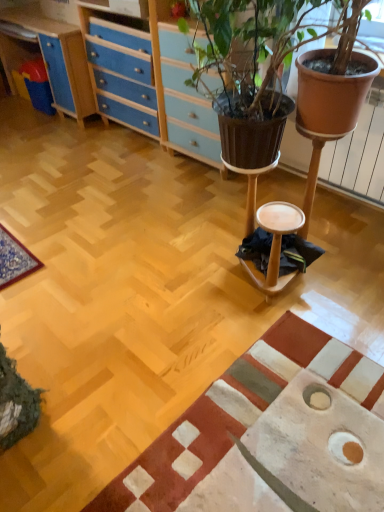
Question: Is wooden stool at center inside or outside of textured beige rug at lower right?

Choices:
 (A) inside
 (B) outside

Answer: (B)

Question: From their relative heights in the image, would you say wooden stool at center is taller or shorter than textured beige rug at lower right?

Choices:
 (A) tall
 (B) short

Answer: (A)

Question: Based on their relative distances, which object is nearer to the textured beige rug at lower right?

Choices:
 (A) wooden stool at center
 (B) blue wood/file cabinet at upper left

Answer: (A)

Question: Which is nearer to the blue wood/file cabinet at upper left?

Choices:
 (A) wooden stool at center
 (B) textured beige rug at lower right

Answer: (A)